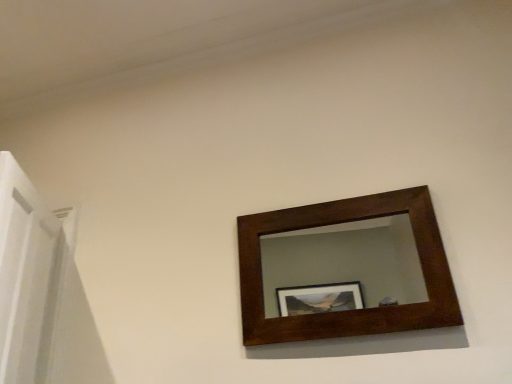
Question: Which direction should I rotate to look at dark wood/matte picture frame at upper center?

Choices:
 (A) left
 (B) right

Answer: (B)